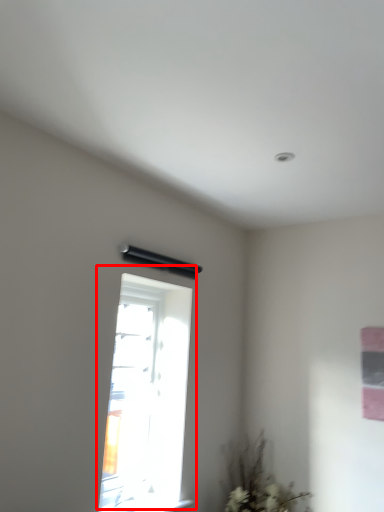
Question: From the image's perspective, where is window (annotated by the red box) located relative to plant?

Choices:
 (A) below
 (B) above

Answer: (B)